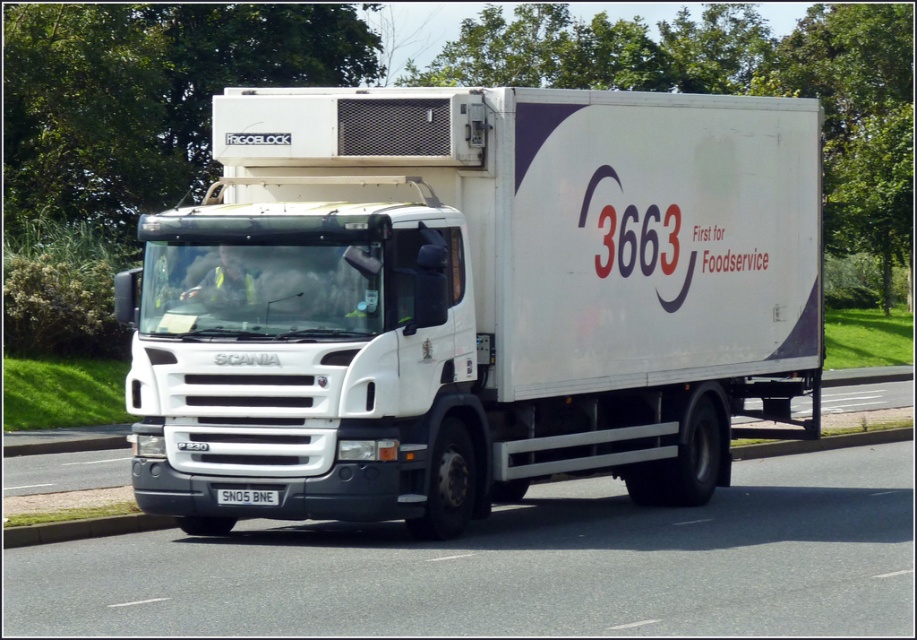
You are a traffic officer observing a vehicle on the road. You notice a white matte truck at center and a white metallic license plate at center. According to traffic regulations, which object should be placed to the right side of the other?

The white metallic license plate at center should be placed to the right side of the white matte truck at center because the white matte truck at center is positioned on the left side of the white metallic license plate at center.

You are a traffic controller observing the scene. The white matte truck at center is positioned at coordinates that might affect traffic flow. Can you determine if the truck is centered on the road or shifted to one side based on its coordinates?

The white matte truck at center is located at point coordinates, so it is centered on the road.

You are a delivery driver who needs to park the white matte truck at center in a specific spot. The parking spot has a center point marked at coordinate (473, 300). Is the truck currently aligned with the parking spot?

The point (473, 300) corresponds to the white matte truck at center, so yes, the truck is aligned with the parking spot.